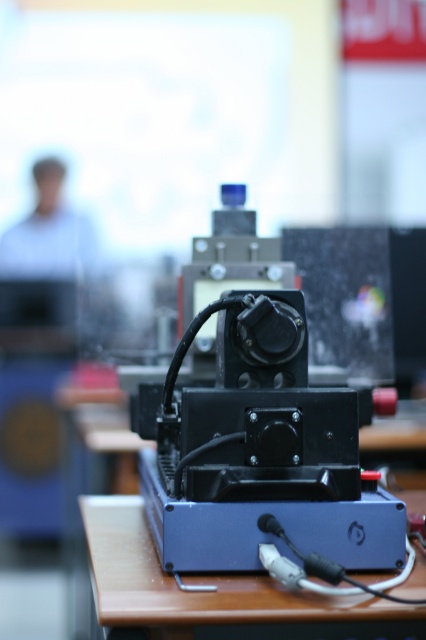
Question: Is metallic black machine at center to the right of blue plastic table at center from the viewer's perspective?

Choices:
 (A) no
 (B) yes

Answer: (B)

Question: Among these points, which one is farthest from the camera?

Choices:
 (A) (120, 588)
 (B) (244, 300)

Answer: (B)

Question: Which point appears closest to the camera in this image?

Choices:
 (A) (100, 605)
 (B) (290, 340)

Answer: (A)

Question: Is metallic black machine at center smaller than blue plastic table at center?

Choices:
 (A) no
 (B) yes

Answer: (A)

Question: In this image, where is metallic black machine at center located relative to blue plastic table at center?

Choices:
 (A) above
 (B) below

Answer: (A)